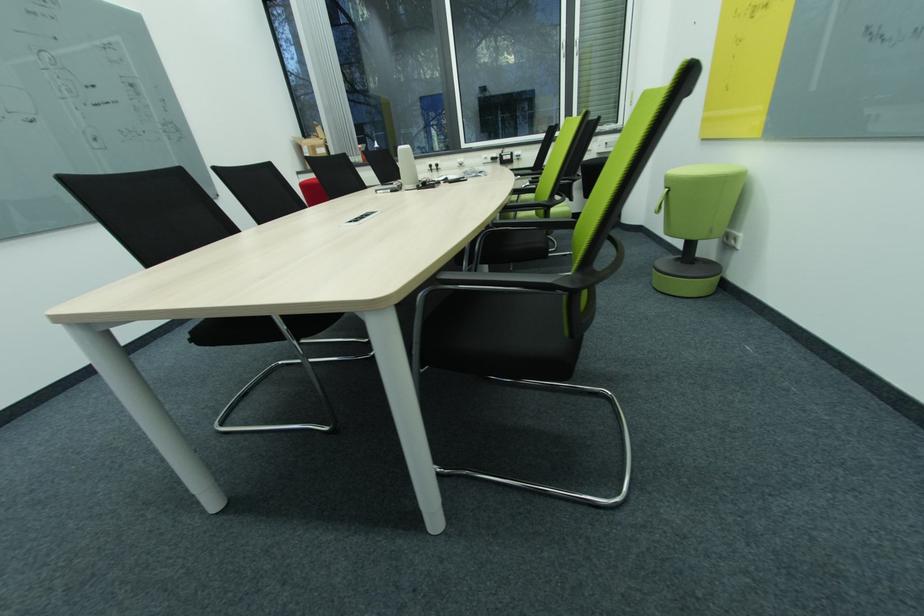
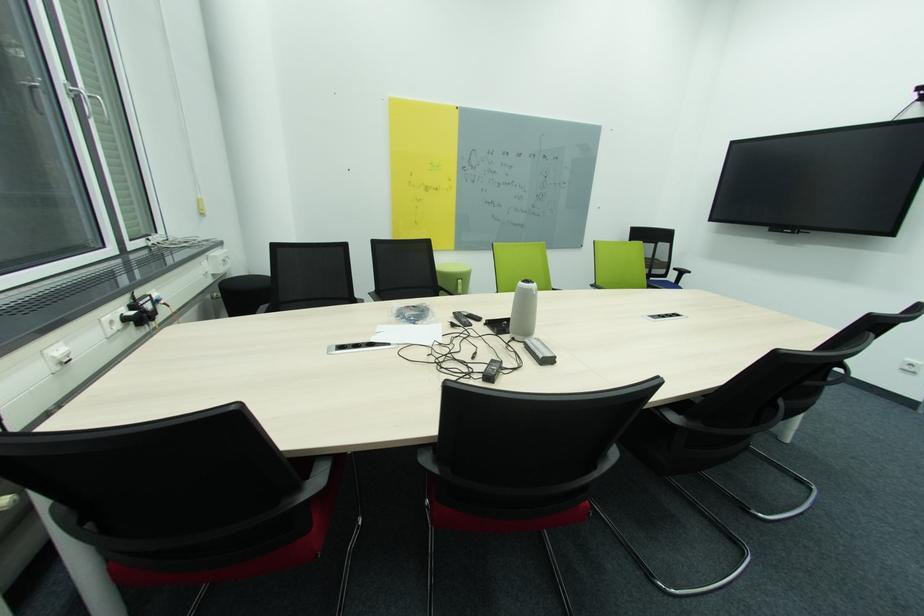
Question: I am providing you with two images of the same scene from different viewpoints. Which of the following objects are not visible in image2?

Choices:
 (A) black chair sitting surface
 (B) black round stool
 (C) brown tray
 (D) green round stool

Answer: (A)